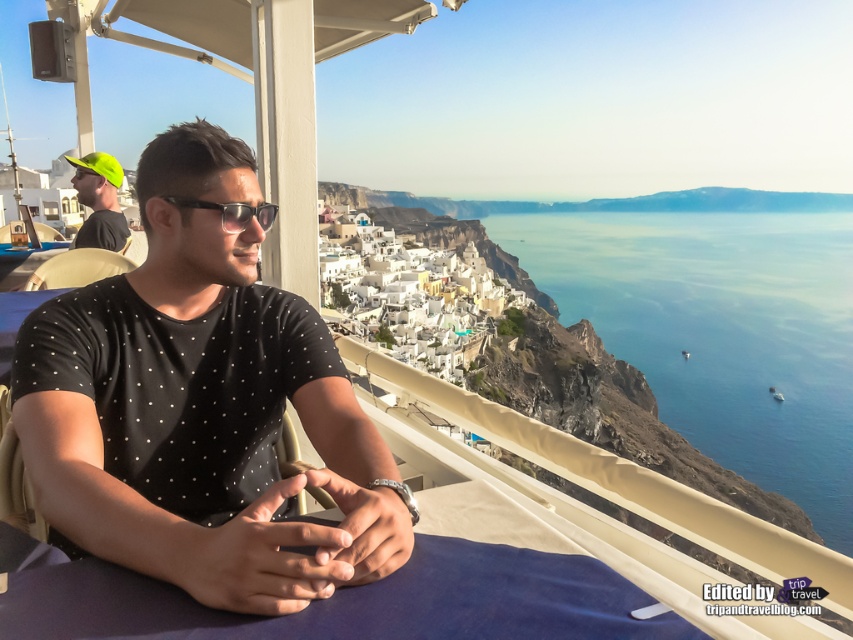
You are a photographer trying to capture both the black dotted shirt at center and the neon yellow cap at upper left in a single shot. Based on their positions, which one will appear larger in the photo?

The black dotted shirt at center will appear larger in the photo because it is closer to the viewer than the neon yellow cap at upper left.

You are a tourist visiting the coastal town and notice the neon yellow cap at upper left and the black plastic sunglasses at center. Which object is located more to the left?

The neon yellow cap at upper left is more to the left than the black plastic sunglasses at center.